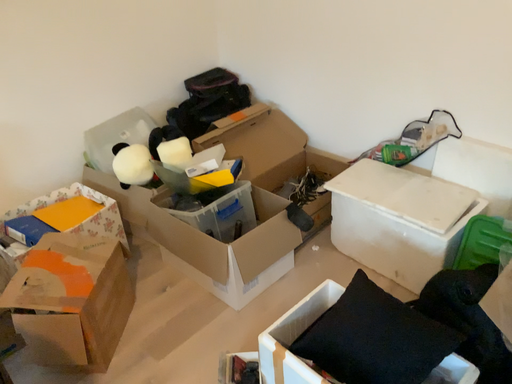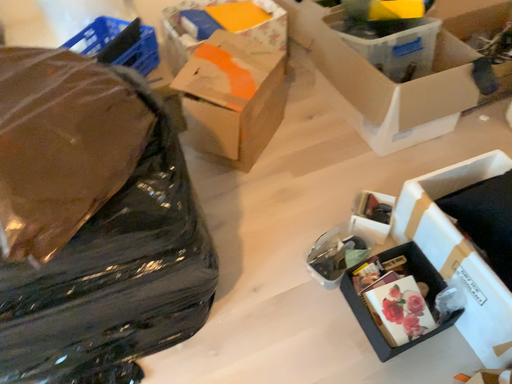
Question: How did the camera likely rotate when shooting the video?

Choices:
 (A) rotated upward
 (B) rotated downward

Answer: (B)